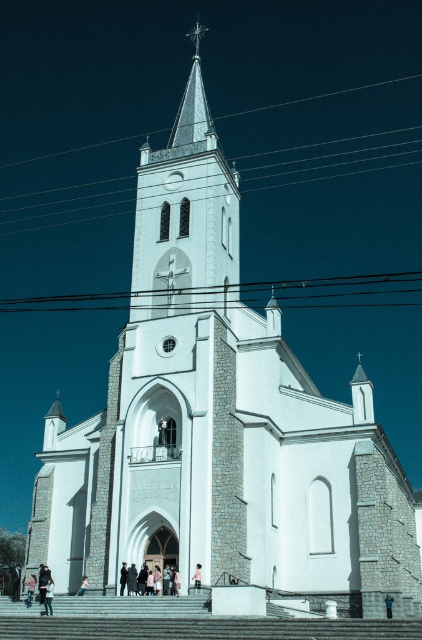
Is black wire at upper center bigger than pink fabric person at lower center?

Indeed, black wire at upper center has a larger size compared to pink fabric person at lower center.

Who is more distant from viewer, (360,305) or (29,595)?

Point (360,305)

At what (x,y) coordinates should I click in order to perform the action: click on black wire at upper center. Please return your answer as a coordinate pair (x, y). Image resolution: width=422 pixels, height=640 pixels. Looking at the image, I should click on (243, 292).

Is the position of smooth concrete stairs at center less distant than that of dark brown leather jacket at lower center?

That is True.

Does smooth concrete stairs at center come behind dark brown leather jacket at lower center?

No, smooth concrete stairs at center is in front of dark brown leather jacket at lower center.

Is point (203, 600) more distant than point (18, 580)?

No.

Locate an element on the screen. smooth concrete stairs at center is located at coordinates (181, 621).

Who is positioned more to the left, dark brown leather jacket at lower center or blue denim jacket at center?

Positioned to the left is dark brown leather jacket at lower center.

Describe the element at coordinates (16, 582) in the screenshot. The width and height of the screenshot is (422, 640). I see `dark brown leather jacket at lower center` at that location.

Which is in front, point (13, 576) or point (392, 596)?

Point (392, 596) is more forward.

Image resolution: width=422 pixels, height=640 pixels. I want to click on dark brown leather jacket at lower center, so click(x=16, y=582).